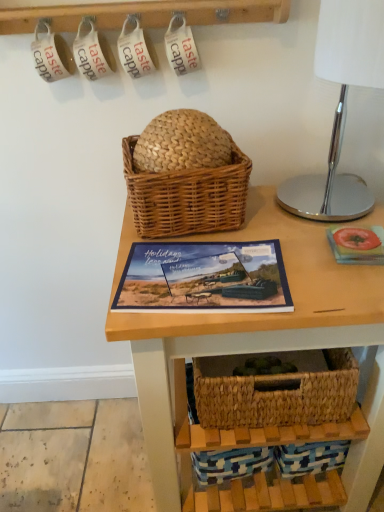
Image resolution: width=384 pixels, height=512 pixels. Find the location of `free area in between matte blue book at center and woven brown picnic basket at center`. free area in between matte blue book at center and woven brown picnic basket at center is located at coordinates (208, 242).